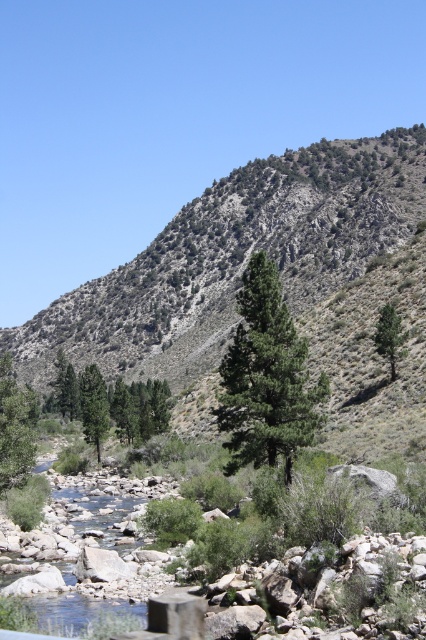
Question: Among these points, which one is nearest to the camera?

Choices:
 (A) (409, 417)
 (B) (101, 417)

Answer: (A)

Question: Based on their relative distances, which object is farther from the clear water at center?

Choices:
 (A) green matte tree at center
 (B) green shrubbery at center
 (C) green matte tree at center-left
 (D) green textured pine at center-right

Answer: (B)

Question: Is clear water at center above green matte tree at center?

Choices:
 (A) yes
 (B) no

Answer: (B)

Question: Based on their relative distances, which object is farther from the green textured pine at center-right?

Choices:
 (A) green matte tree at center-left
 (B) clear water at center
 (C) green shrubbery at center
 (D) green matte tree at left

Answer: (C)

Question: Does green matte tree at left have a larger size compared to green textured pine at center-right?

Choices:
 (A) yes
 (B) no

Answer: (A)

Question: Can you confirm if green matte tree at center is wider than green matte tree at left?

Choices:
 (A) no
 (B) yes

Answer: (A)